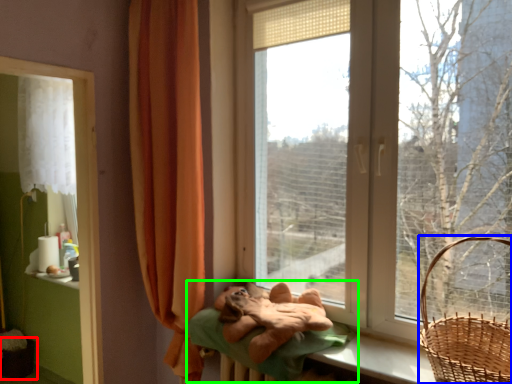
Question: Which is farther away from basket container (highlighted by a red box)? basket (highlighted by a blue box) or bed (highlighted by a green box)?

Choices:
 (A) basket
 (B) bed

Answer: (A)